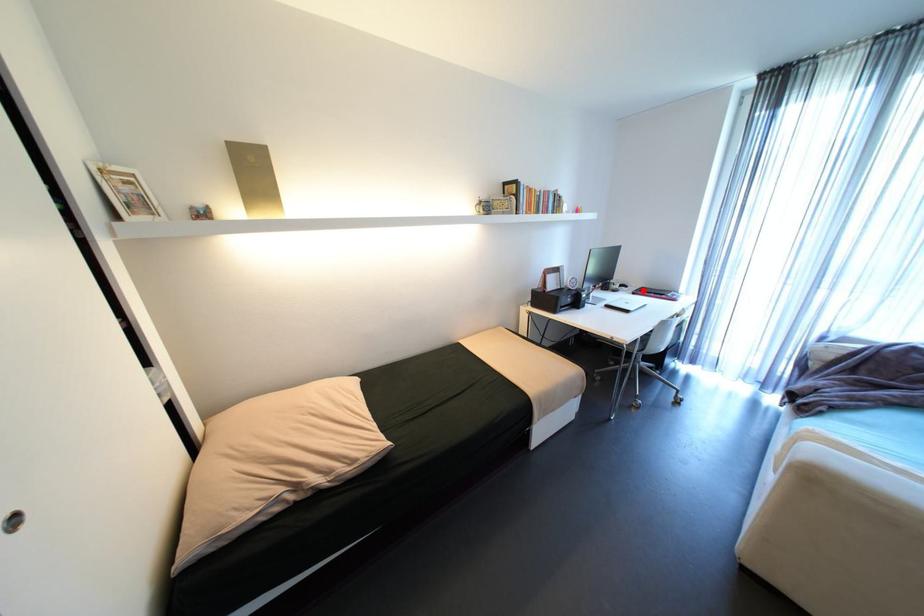
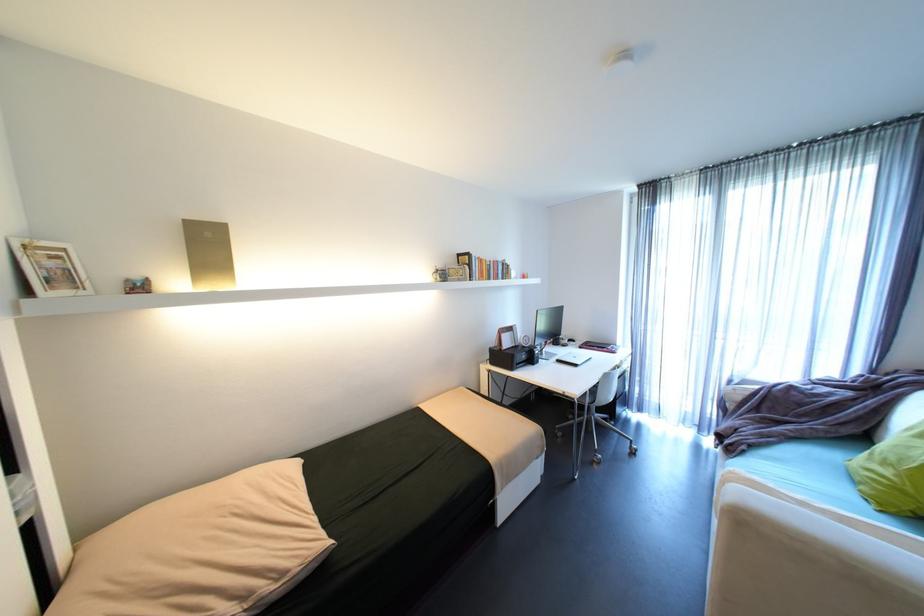
Find the pixel in the second image that matches the highlighted location in the first image.

(589, 344)